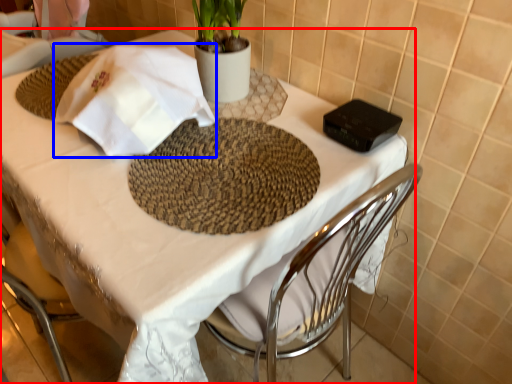
Question: Which object is further to the camera taking this photo, table (highlighted by a red box) or cloth (highlighted by a blue box)?

Choices:
 (A) table
 (B) cloth

Answer: (B)